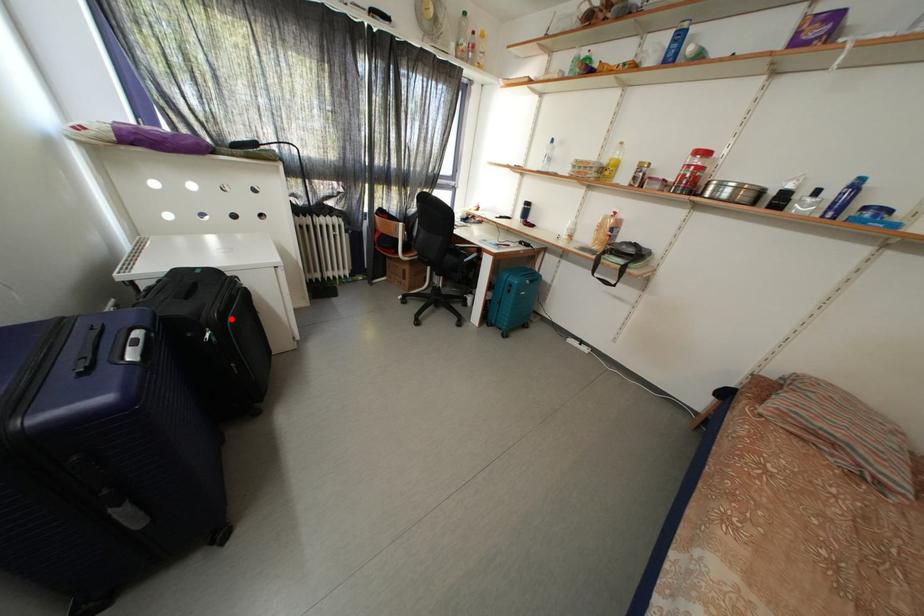
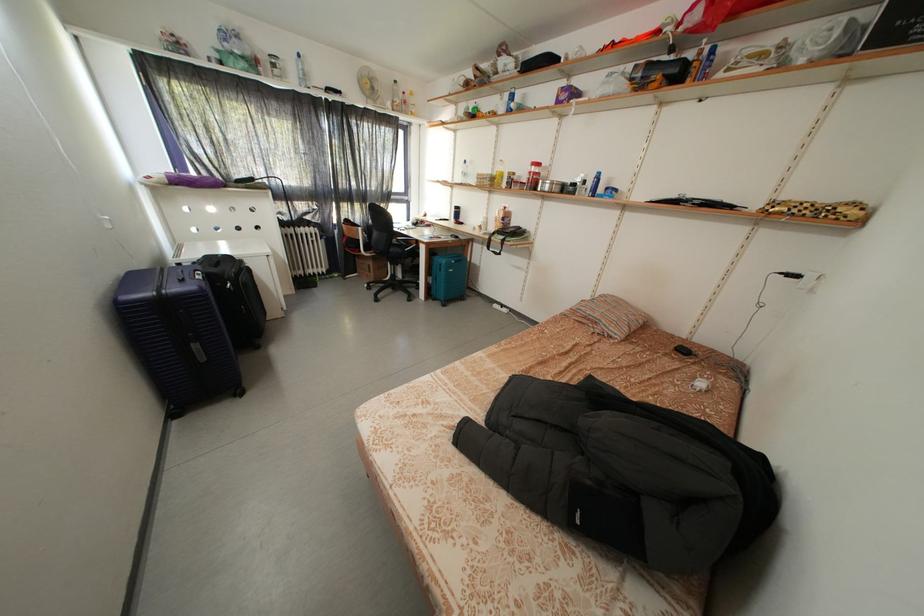
Question: I am providing you with two images of the same scene from different viewpoints. A red point is shown in image1. For the corresponding object point in image2, is it positioned nearer or farther from the camera?

Choices:
 (A) Nearer
 (B) Farther

Answer: (A)